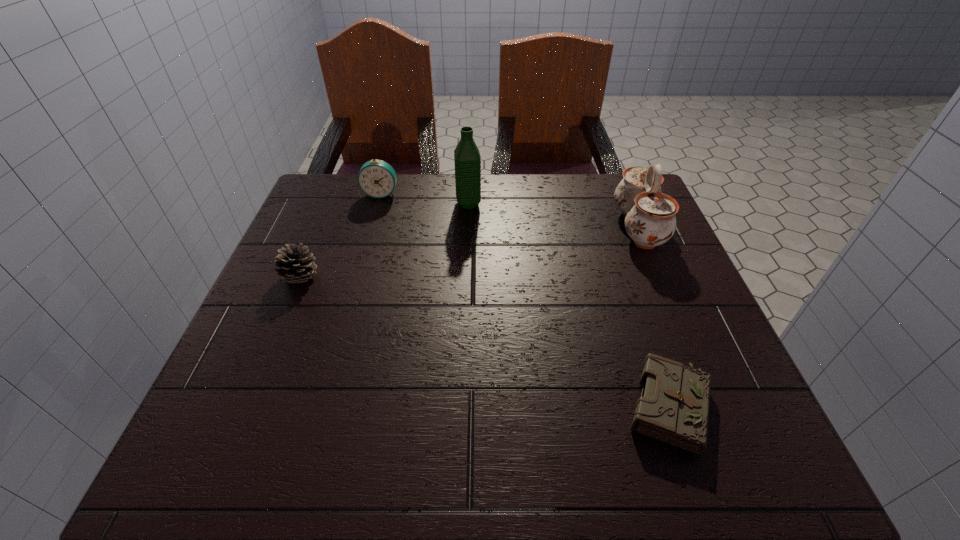
You are a GUI agent. You are given a task and a screenshot of the screen. Output one action in this format:
    pyautogui.click(x=<x>, y=<y>)
    Task: Click on the empty space between the fourth shortest object and the fourth object from right to left
    
    Given the screenshot: What is the action you would take?
    pyautogui.click(x=510, y=211)

Where is `empty space between the third object from left to right and the second tallest object`? Image resolution: width=960 pixels, height=540 pixels. empty space between the third object from left to right and the second tallest object is located at coordinates (553, 215).

This screenshot has width=960, height=540. Find the location of `vacant area that lies between the leftmost object and the nearest object`. vacant area that lies between the leftmost object and the nearest object is located at coordinates (485, 342).

Select which object is the fourth closest to the third object from left to right. Please provide its 2D coordinates. Your answer should be formatted as a tuple, i.e. [(x, y)], where the tuple contains the x and y coordinates of a point satisfying the conditions above.

[(673, 408)]

Identify which object is located as the third nearest to the pinecone. Please provide its 2D coordinates. Your answer should be formatted as a tuple, i.e. [(x, y)], where the tuple contains the x and y coordinates of a point satisfying the conditions above.

[(673, 408)]

Identify the location of vacant point that satisfies the following two spatial constraints: 1. on the back side of the second shortest object; 2. on the left side of the water bottle. The image size is (960, 540). (331, 204).

Image resolution: width=960 pixels, height=540 pixels. Identify the location of free space in the image that satisfies the following two spatial constraints: 1. on the front-facing side of the second object from left to right; 2. on the left side of the water bottle. (378, 204).

Where is `free space in the image that satisfies the following two spatial constraints: 1. on the front-facing side of the alarm clock; 2. on the left side of the diary`? The height and width of the screenshot is (540, 960). free space in the image that satisfies the following two spatial constraints: 1. on the front-facing side of the alarm clock; 2. on the left side of the diary is located at coordinates coord(320,407).

This screenshot has height=540, width=960. I want to click on vacant space that satisfies the following two spatial constraints: 1. by the handle of the fourth shortest object; 2. on the front side of the fourth farthest object, so click(660, 278).